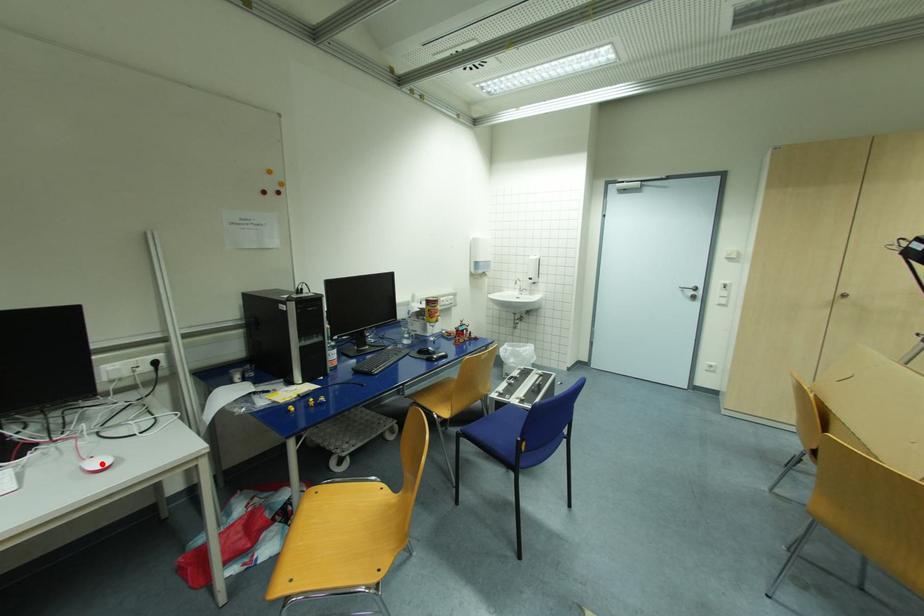
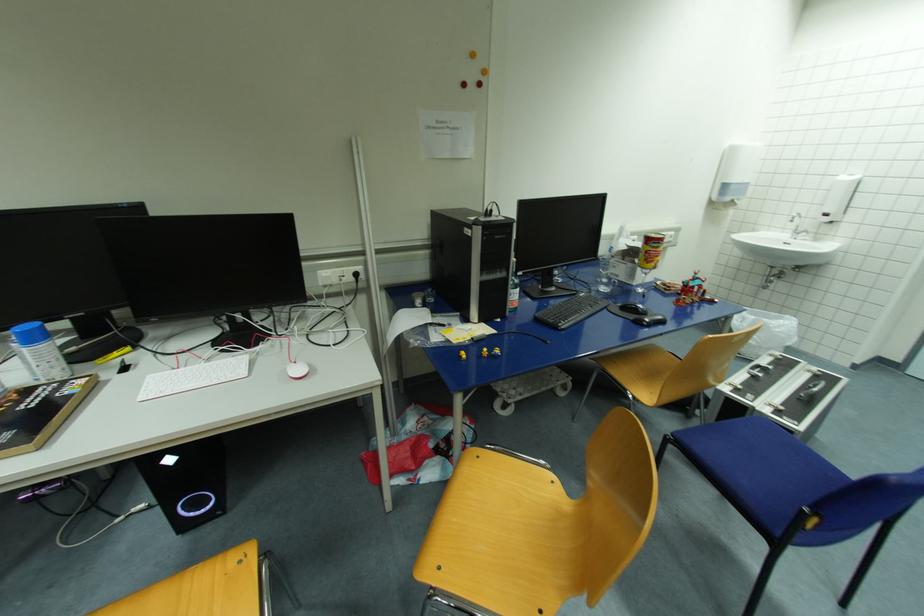
In the second image, find the point that corresponds to the highlighted location in the first image.

(301, 371)